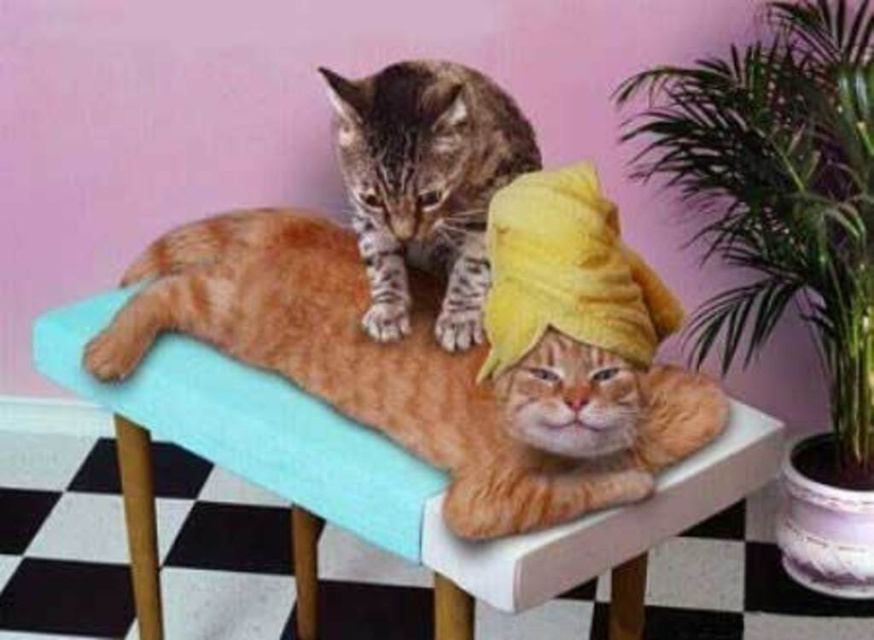
Question: Which point appears farthest from the camera in this image?

Choices:
 (A) (677, 97)
 (B) (687, 467)

Answer: (A)

Question: Which object appears closest to the camera in this image?

Choices:
 (A) tabby cat at upper center
 (B) teal fabric chair at center
 (C) tabby fur cat at upper center
 (D) green leafy plant at right

Answer: (A)

Question: Is green leafy plant at right positioned at the back of teal fabric chair at center?

Choices:
 (A) no
 (B) yes

Answer: (B)

Question: Can you confirm if teal fabric chair at center is positioned to the left of tabby fur cat at upper center?

Choices:
 (A) yes
 (B) no

Answer: (A)

Question: Which point is closer to the camera?

Choices:
 (A) green leafy plant at right
 (B) tabby fur cat at upper center
 (C) tabby cat at upper center
 (D) teal fabric chair at center

Answer: (C)

Question: Can you confirm if tabby cat at upper center is positioned to the left of teal fabric chair at center?

Choices:
 (A) no
 (B) yes

Answer: (A)